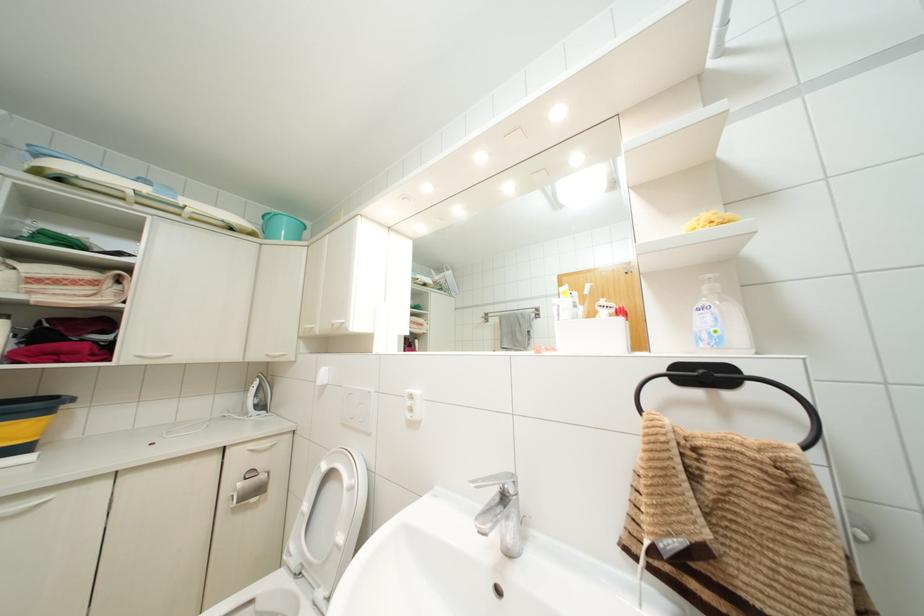
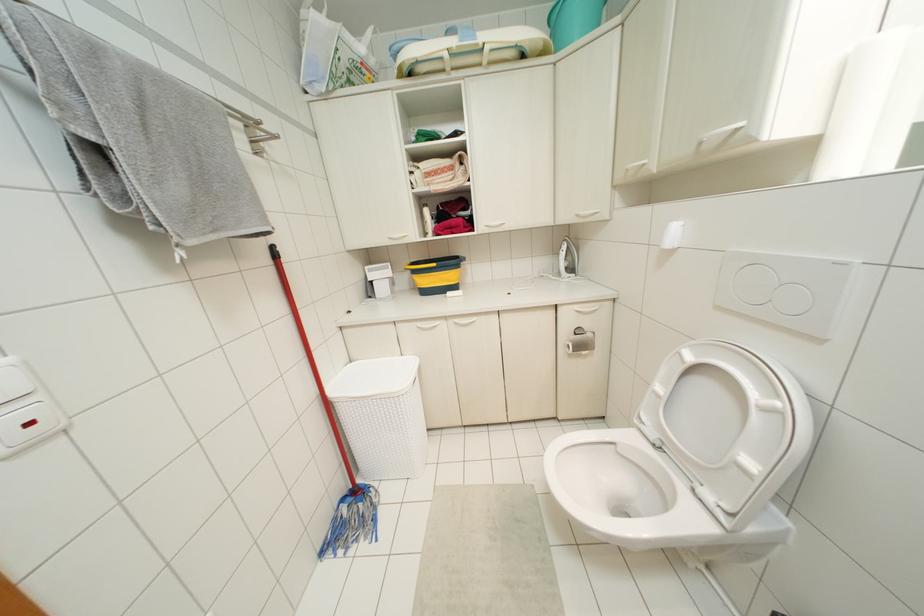
The point at (262,475) is marked in the first image. Where is the corresponding point in the second image?

(589, 334)